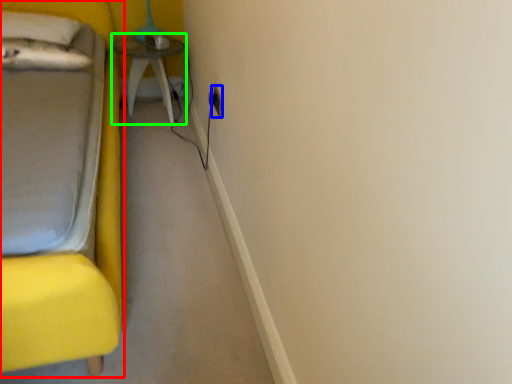
Question: Which object is the farthest from furniture (highlighted by a red box)? Choose among these: electric outlet (highlighted by a blue box) or table (highlighted by a green box).

Choices:
 (A) electric outlet
 (B) table

Answer: (A)